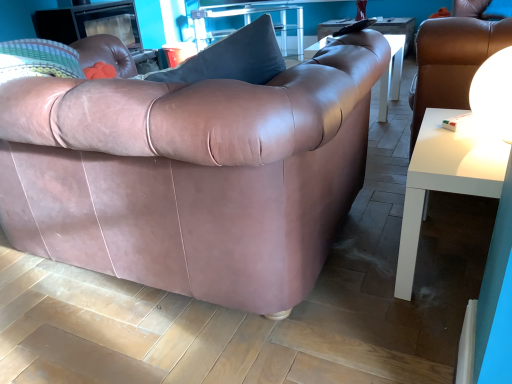
You are a GUI agent. You are given a task and a screenshot of the screen. Output one action in this format:
    pyautogui.click(x=<x>, y=<y>)
    Task: Click on the empty space that is in between matte leather couch at center and white glossy table at lower right, marked as the second table in a back-to-front arrangement
    
    Given the screenshot: What is the action you would take?
    pyautogui.click(x=388, y=287)